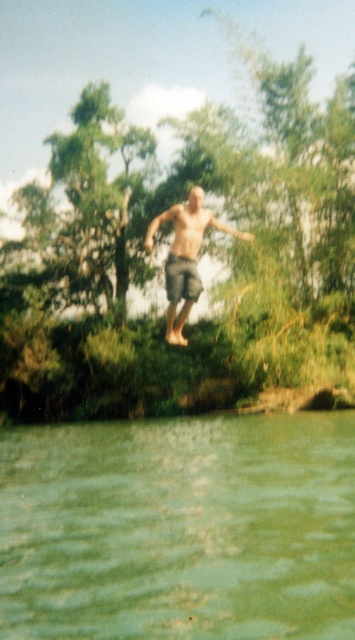
Is green murky water at lower center shorter than gray cotton shorts at center?

Indeed, green murky water at lower center has a lesser height compared to gray cotton shorts at center.

Between point (242, 586) and point (183, 262), which one is positioned in front?

Point (242, 586) is in front.

Locate an element on the screen. green murky water at lower center is located at coordinates (178, 529).

This screenshot has height=640, width=355. Identify the location of green murky water at lower center. (178, 529).